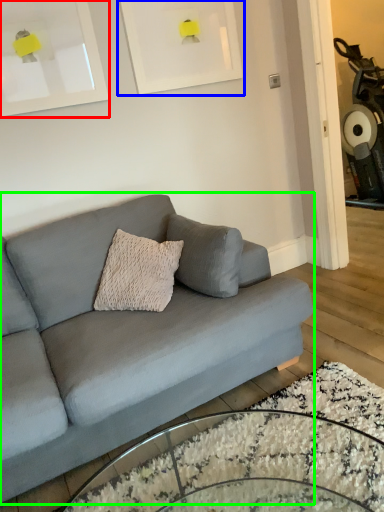
Question: Considering the real-world distances, which object is closest to picture frame (highlighted by a red box)? picture frame (highlighted by a blue box) or studio couch (highlighted by a green box).

Choices:
 (A) picture frame
 (B) studio couch

Answer: (A)